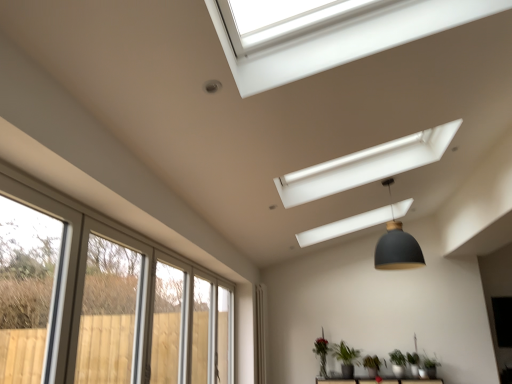
Question: Is matte black pendant lamp at center far away from clear glass screen door at lower left?

Choices:
 (A) no
 (B) yes

Answer: (B)

Question: Considering the relative sizes of matte black pendant lamp at center and clear glass screen door at lower left in the image provided, is matte black pendant lamp at center shorter than clear glass screen door at lower left?

Choices:
 (A) yes
 (B) no

Answer: (A)

Question: Considering the relative positions of matte black pendant lamp at center and clear glass screen door at lower left in the image provided, is matte black pendant lamp at center in front of clear glass screen door at lower left?

Choices:
 (A) yes
 (B) no

Answer: (B)

Question: Is matte black pendant lamp at center thinner than clear glass screen door at lower left?

Choices:
 (A) yes
 (B) no

Answer: (B)

Question: Is matte black pendant lamp at center further to camera compared to clear glass screen door at lower left?

Choices:
 (A) no
 (B) yes

Answer: (B)

Question: Considering the relative positions of matte black pendant lamp at center and clear glass screen door at lower left in the image provided, is matte black pendant lamp at center to the left of clear glass screen door at lower left from the viewer's perspective?

Choices:
 (A) no
 (B) yes

Answer: (A)

Question: Considering the relative positions of green matte plant at lower center, the fourth plant from the right, and green matte plant at lower center, the 2th plant in the left-to-right sequence, in the image provided, is green matte plant at lower center, the fourth plant from the right, to the left of green matte plant at lower center, the 2th plant in the left-to-right sequence, from the viewer's perspective?

Choices:
 (A) no
 (B) yes

Answer: (B)

Question: From the image's perspective, is green matte plant at lower center, which is counted as the 1th plant, starting from the left, beneath green matte plant at lower center, the 2th plant in the left-to-right sequence?

Choices:
 (A) yes
 (B) no

Answer: (A)

Question: Considering the relative sizes of green matte plant at lower center, which is counted as the 1th plant, starting from the left, and green matte plant at lower center, the third plant from the right, in the image provided, is green matte plant at lower center, which is counted as the 1th plant, starting from the left, bigger than green matte plant at lower center, the third plant from the right,?

Choices:
 (A) yes
 (B) no

Answer: (B)

Question: Is green matte plant at lower center, the fourth plant from the right, aimed at green matte plant at lower center, the third plant from the right?

Choices:
 (A) no
 (B) yes

Answer: (A)

Question: Would you say green matte plant at lower center, the 2th plant in the left-to-right sequence, is part of green matte plant at lower center, the fourth plant from the right,'s contents?

Choices:
 (A) yes
 (B) no

Answer: (B)

Question: Considering the relative sizes of green matte plant at lower center, which is counted as the 1th plant, starting from the left, and green matte plant at lower center, the 2th plant in the left-to-right sequence, in the image provided, is green matte plant at lower center, which is counted as the 1th plant, starting from the left, shorter than green matte plant at lower center, the 2th plant in the left-to-right sequence,?

Choices:
 (A) yes
 (B) no

Answer: (B)

Question: Is green matte plant at lower center, the 4th plant viewed from the left, looking in the opposite direction of white fabric curtain at lower center?

Choices:
 (A) yes
 (B) no

Answer: (B)